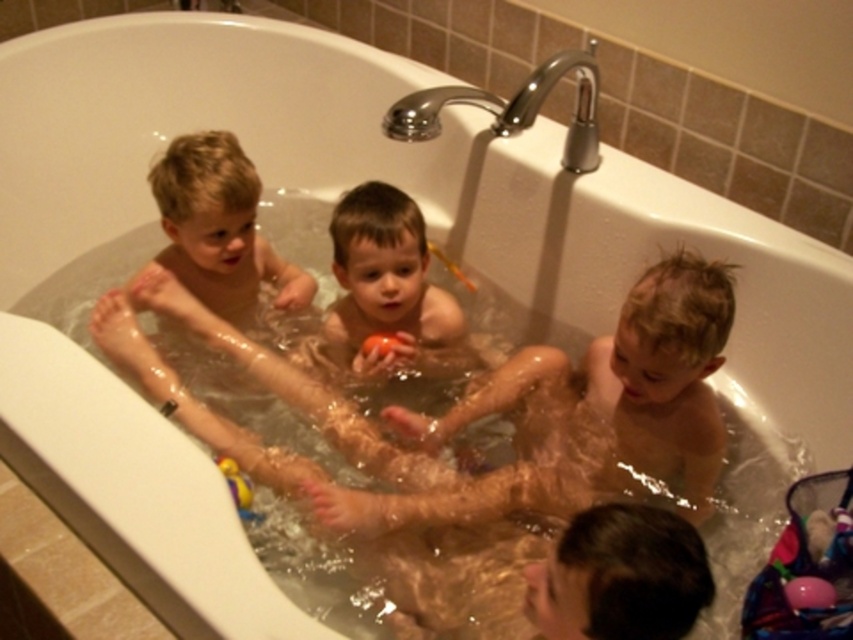
Between smooth skin child at center and yellow rubber duck at lower left, which one appears on the right side from the viewer's perspective?

Positioned to the right is smooth skin child at center.

Is smooth skin child at center closer to the viewer compared to yellow rubber duck at lower left?

That is False.

What do you see at coordinates (389, 291) in the screenshot? The width and height of the screenshot is (853, 640). I see `smooth skin child at center` at bounding box center [389, 291].

The width and height of the screenshot is (853, 640). In order to click on smooth skin child at center in this screenshot , I will do point(389,291).

You are a GUI agent. You are given a task and a screenshot of the screen. Output one action in this format:
    pyautogui.click(x=<x>, y=<y>)
    Task: Click on the smooth skin child at center
    This screenshot has height=640, width=853.
    Given the screenshot: What is the action you would take?
    pyautogui.click(x=389, y=291)

Can you confirm if smooth skin child at center is bigger than rubber matte ball at center?

Yes, smooth skin child at center is bigger than rubber matte ball at center.

Is point (389, 188) more distant than point (395, 340)?

That is False.

I want to click on smooth skin child at center, so click(x=389, y=291).

Is yellow rubber duck at lower left shorter than rubber matte ball at center?

Incorrect, yellow rubber duck at lower left's height does not fall short of rubber matte ball at center's.

Between point (231, 467) and point (378, 348), which one is positioned in front?

Positioned in front is point (231, 467).

The height and width of the screenshot is (640, 853). I want to click on yellow rubber duck at lower left, so click(x=238, y=488).